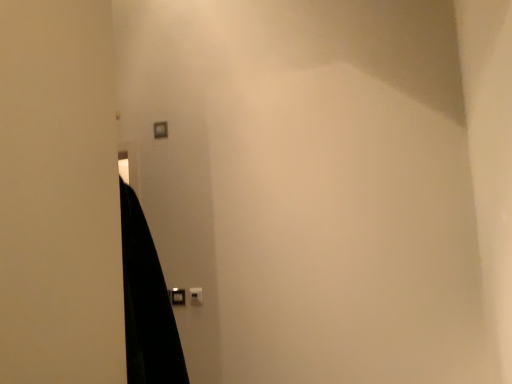
Question: Considering the relative sizes of white plastic light switch at center, which appears as the first light switch when ordered from the bottom, and matte plastic light switch at upper center, acting as the 2th light switch starting from the right, in the image provided, is white plastic light switch at center, which appears as the first light switch when ordered from the bottom, wider than matte plastic light switch at upper center, acting as the 2th light switch starting from the right,?

Choices:
 (A) yes
 (B) no

Answer: (B)

Question: Considering the relative sizes of white plastic light switch at center, arranged as the second light switch when viewed from the back, and matte plastic light switch at upper center, marked as the first light switch in a top-to-bottom arrangement, in the image provided, is white plastic light switch at center, arranged as the second light switch when viewed from the back, smaller than matte plastic light switch at upper center, marked as the first light switch in a top-to-bottom arrangement,?

Choices:
 (A) no
 (B) yes

Answer: (B)

Question: Considering the relative sizes of white plastic light switch at center, which is the 1th light switch from right to left, and matte plastic light switch at upper center, arranged as the second light switch when ordered from the bottom, in the image provided, is white plastic light switch at center, which is the 1th light switch from right to left, bigger than matte plastic light switch at upper center, arranged as the second light switch when ordered from the bottom,?

Choices:
 (A) yes
 (B) no

Answer: (B)

Question: Considering the relative positions of white plastic light switch at center, which appears as the first light switch when ordered from the bottom, and matte plastic light switch at upper center, acting as the 2th light switch starting from the right, in the image provided, is white plastic light switch at center, which appears as the first light switch when ordered from the bottom, to the left of matte plastic light switch at upper center, acting as the 2th light switch starting from the right, from the viewer's perspective?

Choices:
 (A) no
 (B) yes

Answer: (A)

Question: From the image's perspective, is white plastic light switch at center, which appears as the 2th light switch when viewed from the top, located beneath matte plastic light switch at upper center, placed as the first light switch when sorted from left to right?

Choices:
 (A) yes
 (B) no

Answer: (A)

Question: Considering the positions of matte plastic light switch at upper center, acting as the 2th light switch starting from the front, and black plastic door handle at lower center in the image, is matte plastic light switch at upper center, acting as the 2th light switch starting from the front, bigger or smaller than black plastic door handle at lower center?

Choices:
 (A) big
 (B) small

Answer: (A)

Question: From a real-world perspective, relative to black plastic door handle at lower center, is matte plastic light switch at upper center, marked as the first light switch in a top-to-bottom arrangement, vertically above or below?

Choices:
 (A) below
 (B) above

Answer: (B)

Question: Is matte plastic light switch at upper center, arranged as the first light switch when viewed from the back, spatially inside black plastic door handle at lower center, or outside of it?

Choices:
 (A) outside
 (B) inside

Answer: (A)

Question: Is point (158, 132) closer or farther from the camera than point (183, 302)?

Choices:
 (A) closer
 (B) farther

Answer: (B)

Question: In terms of size, does white plastic light switch at center, the 2th light switch when ordered from left to right, appear bigger or smaller than black plastic door handle at lower center?

Choices:
 (A) big
 (B) small

Answer: (B)

Question: From a real-world perspective, is white plastic light switch at center, which appears as the 2th light switch when viewed from the top, positioned above or below black plastic door handle at lower center?

Choices:
 (A) above
 (B) below

Answer: (B)

Question: Looking at their shapes, would you say white plastic light switch at center, which appears as the 2th light switch when viewed from the top, is wider or thinner than black plastic door handle at lower center?

Choices:
 (A) thin
 (B) wide

Answer: (A)

Question: Which is correct: white plastic light switch at center, arranged as the 1th light switch when viewed from the front, is inside black plastic door handle at lower center, or outside of it?

Choices:
 (A) inside
 (B) outside

Answer: (B)

Question: Is point (199, 286) closer or farther from the camera than point (159, 125)?

Choices:
 (A) closer
 (B) farther

Answer: (A)

Question: Considering the positions of white plastic light switch at center, arranged as the 1th light switch when viewed from the front, and matte plastic light switch at upper center, placed as the first light switch when sorted from left to right, in the image, is white plastic light switch at center, arranged as the 1th light switch when viewed from the front, taller or shorter than matte plastic light switch at upper center, placed as the first light switch when sorted from left to right,?

Choices:
 (A) tall
 (B) short

Answer: (B)